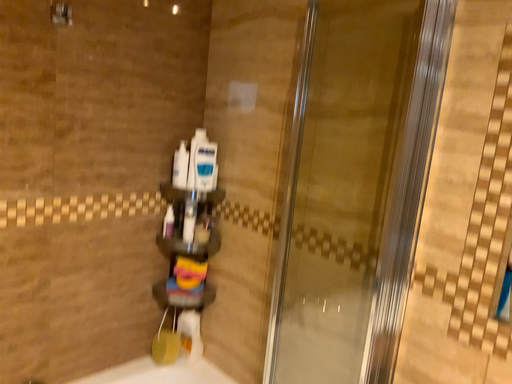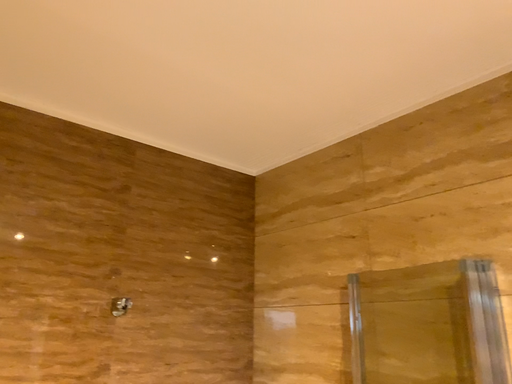
Question: Which way did the camera rotate in the video?

Choices:
 (A) rotated downward
 (B) rotated upward

Answer: (B)